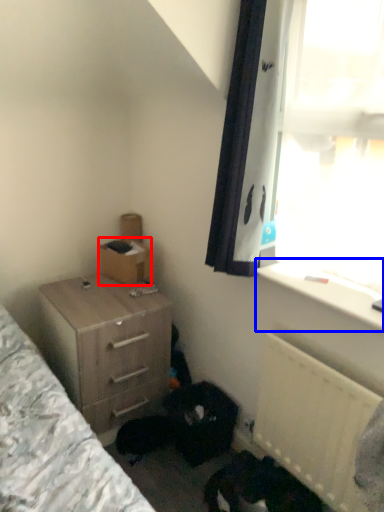
Question: Which of the following is the closest to the observer, box (highlighted by a red box) or window sill (highlighted by a blue box)?

Choices:
 (A) box
 (B) window sill

Answer: (B)